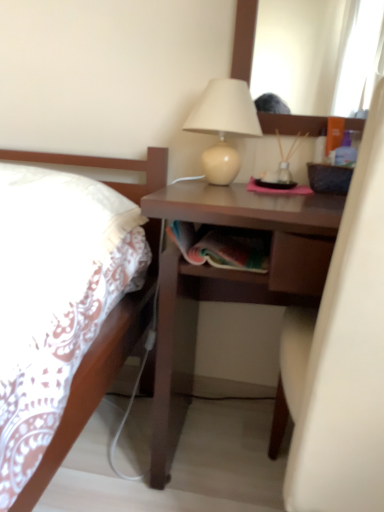
Where is `free area below brown matte desk at center (from a real-world perspective)`? free area below brown matte desk at center (from a real-world perspective) is located at coordinates (217, 442).